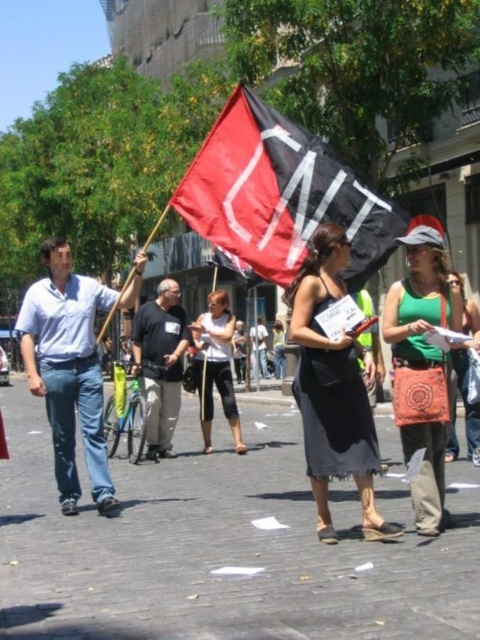
You are a photographer standing at the starting point of the demonstration route. You want to capture both the flag holder and the second protester in your photo. The flag holder is at point (434,275) and the second protester is at point (135,371). Since you can only focus on one point at a time, which point should you focus on to ensure the other is still in the frame?

You should focus on point (135,371) because point (434,275) is in front of it. By focusing on the point closer to you, the background point will still be within the frame.

You are a photographer trying to capture a clear photo of both the black fabric flag at center and the light blue shirt at center. Which object should you focus on first if you want to ensure both are in focus, considering their sizes?

The black fabric flag at center has a smaller size compared to the light blue shirt at center. Since the flag is smaller, you should focus on the light blue shirt at center first to ensure depth of field covers both objects.

You are a photographer standing at the center of the street. You want to take a picture of the black fabric flag at center. Where should you position your camera to capture it in the frame?

Position your camera at the center of the street to capture the black fabric flag at center, which is located at point (279, 195) in the image coordinates.